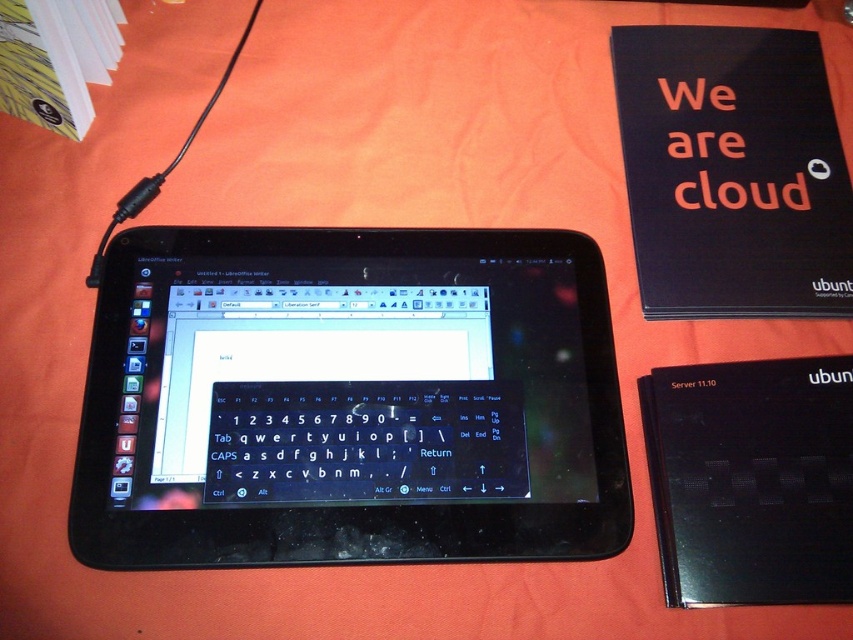
Does point (189, 481) lie in front of point (648, 451)?

Yes, point (189, 481) is closer to viewer.

Does black plastic tablet at center have a greater width compared to black matte tablet at center?

Indeed, black plastic tablet at center has a greater width compared to black matte tablet at center.

Is point (135, 376) closer to camera compared to point (712, 570)?

No, (135, 376) is further to viewer.

Identify the location of black plastic tablet at center. This screenshot has width=853, height=640. (349, 400).